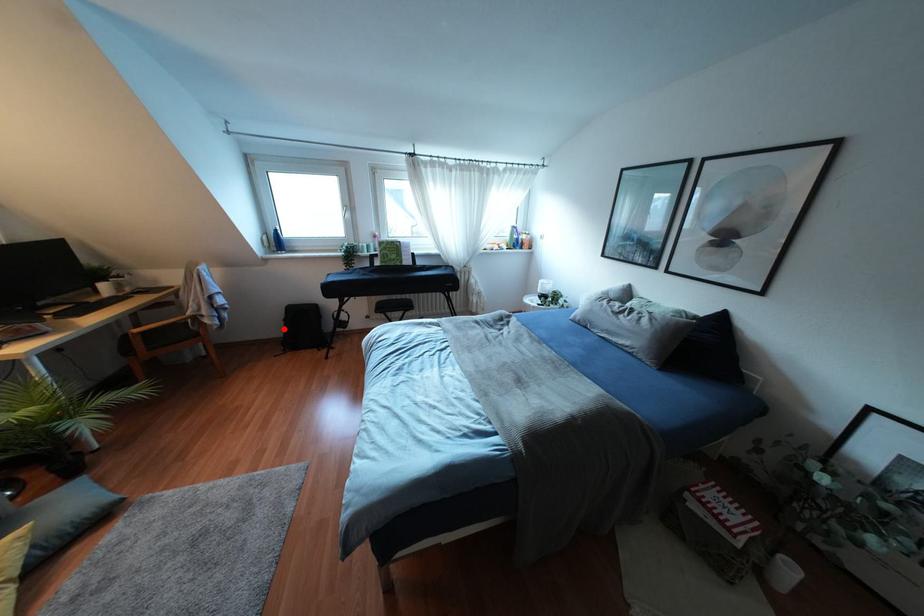
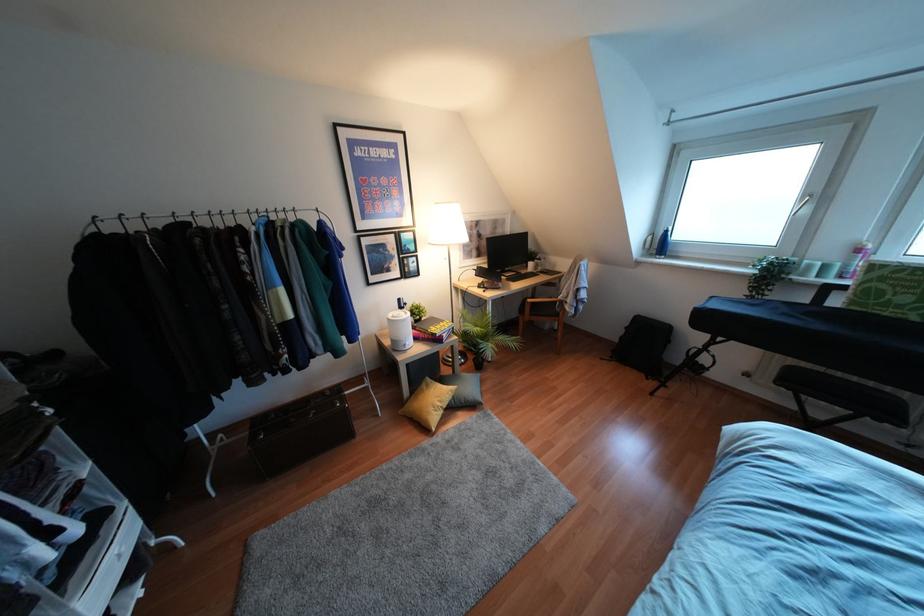
Question: I am providing you with two images of the same scene from different viewpoints. Given a red point in image1, look at the same physical point in image2. Is it:

Choices:
 (A) Closer to the viewpoint
 (B) Farther from the viewpoint

Answer: (A)